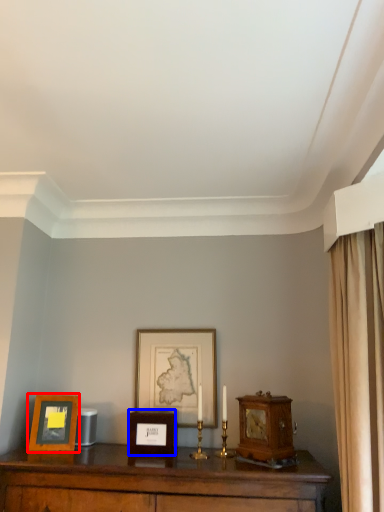
Question: Among these objects, which one is farthest to the camera, picture frame (highlighted by a red box) or picture frame (highlighted by a blue box)?

Choices:
 (A) picture frame
 (B) picture frame

Answer: (B)